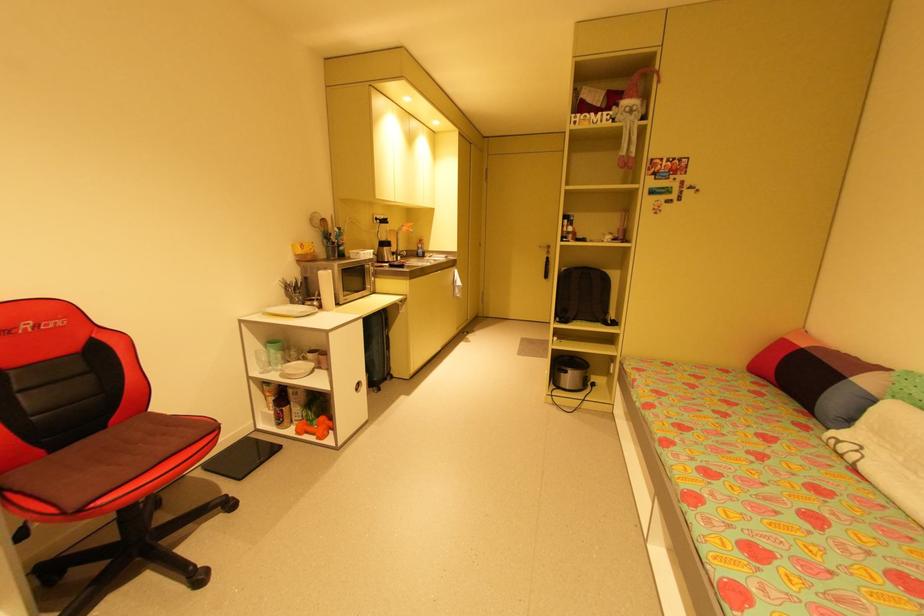
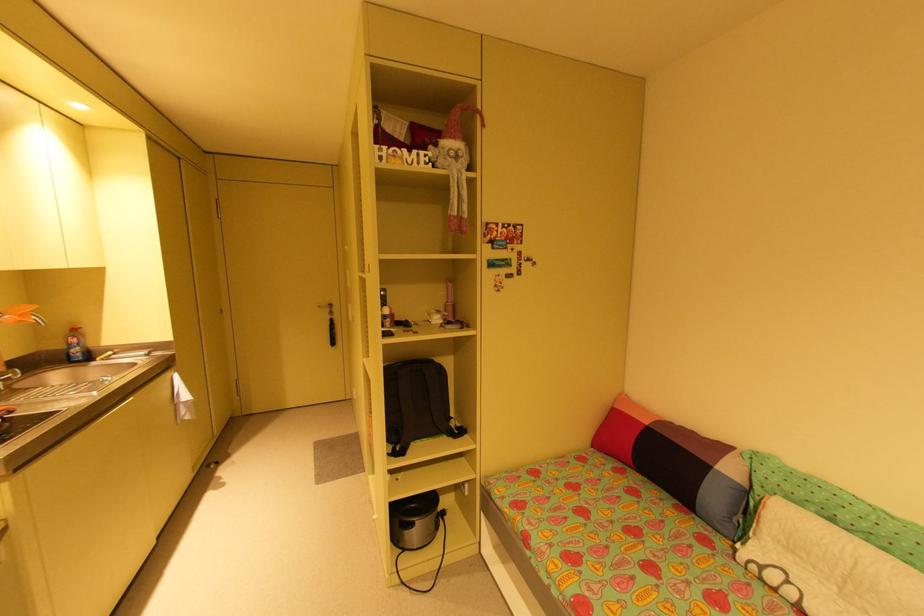
In the second image, find the point that corresponds to point 570,371 in the first image.

(417, 525)